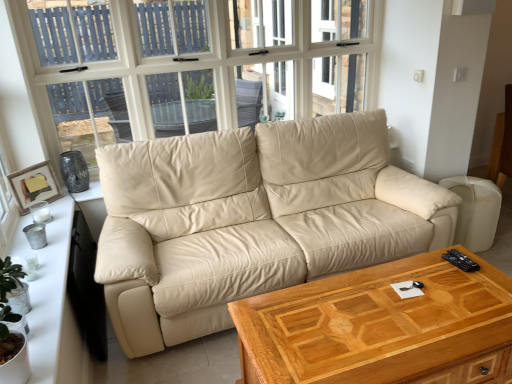
Identify the location of white glass window at upper center. (195, 57).

The image size is (512, 384). What do you see at coordinates (57, 298) in the screenshot? I see `white wood dresser at left` at bounding box center [57, 298].

Image resolution: width=512 pixels, height=384 pixels. What do you see at coordinates (379, 326) in the screenshot?
I see `wooden coffee table at center` at bounding box center [379, 326].

Locate an element on the screen. The width and height of the screenshot is (512, 384). white glass window at upper center is located at coordinates (195, 57).

Are white glass window at upper center and wooden coffee table at center making contact?

No, white glass window at upper center is not in contact with wooden coffee table at center.

How different are the orientations of white glass window at upper center and wooden coffee table at center in degrees?

0.579 degrees separate the facing orientations of white glass window at upper center and wooden coffee table at center.

Between white glass window at upper center and wooden coffee table at center, which one has larger size?

With larger size is white glass window at upper center.

Considering the sizes of objects white glass window at upper center and wooden coffee table at center in the image provided, who is taller, white glass window at upper center or wooden coffee table at center?

With more height is white glass window at upper center.

Is wooden coffee table at center far from wooden framed picture at left?

Yes.

Which is in front, wooden coffee table at center or wooden framed picture at left?

Positioned in front is wooden coffee table at center.

From a real-world perspective, who is located lower, wooden coffee table at center or wooden framed picture at left?

wooden coffee table at center, from a real-world perspective.

Is wooden coffee table at center located outside wooden framed picture at left?

Absolutely, wooden coffee table at center is external to wooden framed picture at left.

How different are the orientations of white wood dresser at left and wooden coffee table at center in degrees?

90.2 degrees.

From the image's perspective, which object appears higher, white wood dresser at left or wooden coffee table at center?

From the image's view, white wood dresser at left is above.

I want to click on table below the white wood dresser at left (from the image's perspective), so click(x=379, y=326).

Is white glass window at upper center inside the boundaries of wooden framed picture at left, or outside?

white glass window at upper center exists outside the volume of wooden framed picture at left.

You are a GUI agent. You are given a task and a screenshot of the screen. Output one action in this format:
    pyautogui.click(x=<x>, y=<y>)
    Task: Click on the window above the wooden framed picture at left (from a real-world perspective)
    
    Given the screenshot: What is the action you would take?
    pyautogui.click(x=195, y=57)

Between white glass window at upper center and wooden framed picture at left, which one has smaller width?

wooden framed picture at left.

Based on their sizes in the image, would you say white glass window at upper center is bigger or smaller than wooden framed picture at left?

In the image, white glass window at upper center appears to be larger than wooden framed picture at left.

Is white glass window at upper center inside white wood dresser at left?

No, white glass window at upper center is not a part of white wood dresser at left.

Based on the photo, does white wood dresser at left turn towards white glass window at upper center?

No, white wood dresser at left is not aimed at white glass window at upper center.

Is white wood dresser at left not close to white glass window at upper center?

Yes, white wood dresser at left is far from white glass window at upper center.

From the image's perspective, is white wood dresser at left beneath white glass window at upper center?

Yes, from the image's perspective, white wood dresser at left is beneath white glass window at upper center.

From the image's perspective, is white wood dresser at left positioned above or below wooden framed picture at left?

Clearly, from the image's perspective, white wood dresser at left is below wooden framed picture at left.

Is white wood dresser at left to the left or to the right of wooden framed picture at left in the image?

white wood dresser at left is positioned on wooden framed picture at left's right side.

Who is smaller, white wood dresser at left or wooden framed picture at left?

Smaller between the two is wooden framed picture at left.

What's the angular difference between wooden coffee table at center and white glass window at upper center's facing directions?

wooden coffee table at center and white glass window at upper center are facing 0.579 degrees away from each other.

Considering the positions of objects wooden coffee table at center and white glass window at upper center in the image provided, who is more to the right, wooden coffee table at center or white glass window at upper center?

From the viewer's perspective, wooden coffee table at center appears more on the right side.

Is wooden coffee table at center taller than white glass window at upper center?

No, wooden coffee table at center is not taller than white glass window at upper center.

From a real-world perspective, is wooden coffee table at center positioned above or below white glass window at upper center?

wooden coffee table at center is situated lower than white glass window at upper center in the real world.

Locate an element on the screen. The width and height of the screenshot is (512, 384). table below the white glass window at upper center (from the image's perspective) is located at coordinates (379, 326).

Locate an element on the screen. The height and width of the screenshot is (384, 512). picture frame that appears on the left of wooden coffee table at center is located at coordinates (34, 185).

Looking at the image, which one is located further to wooden coffee table at center, white glass window at upper center or white wood dresser at left?

The object further to wooden coffee table at center is white glass window at upper center.

When comparing their distances from white wood dresser at left, does white glass window at upper center or beige leather couch at center seem further?

The object further to white wood dresser at left is white glass window at upper center.

When comparing their distances from wooden coffee table at center, does white wood dresser at left or beige leather couch at center seem further?

white wood dresser at left lies further to wooden coffee table at center than the other object.

Based on their spatial positions, is beige leather couch at center or white wood dresser at left closer to white glass window at upper center?

beige leather couch at center is positioned closer to the anchor white glass window at upper center.

Which object lies nearer to the anchor point white glass window at upper center, wooden framed picture at left or white wood dresser at left?

wooden framed picture at left is closer to white glass window at upper center.

When comparing their distances from wooden framed picture at left, does beige leather couch at center or white wood dresser at left seem further?

The object further to wooden framed picture at left is beige leather couch at center.

From the image, which object appears to be farther from white wood dresser at left, wooden framed picture at left or wooden coffee table at center?

Based on the image, wooden coffee table at center appears to be further to white wood dresser at left.

Based on their spatial positions, is wooden framed picture at left or beige leather couch at center closer to white wood dresser at left?

The object closer to white wood dresser at left is wooden framed picture at left.

Locate an element on the screen. Image resolution: width=512 pixels, height=384 pixels. window between wooden framed picture at left and wooden coffee table at center from left to right is located at coordinates (195, 57).

Find the location of `window located between white wood dresser at left and wooden framed picture at left in the depth direction`. window located between white wood dresser at left and wooden framed picture at left in the depth direction is located at coordinates (195, 57).

Find the location of `window located between wooden framed picture at left and beige leather couch at center in the left-right direction`. window located between wooden framed picture at left and beige leather couch at center in the left-right direction is located at coordinates (195, 57).

I want to click on window between white wood dresser at left and beige leather couch at center from left to right, so click(195, 57).